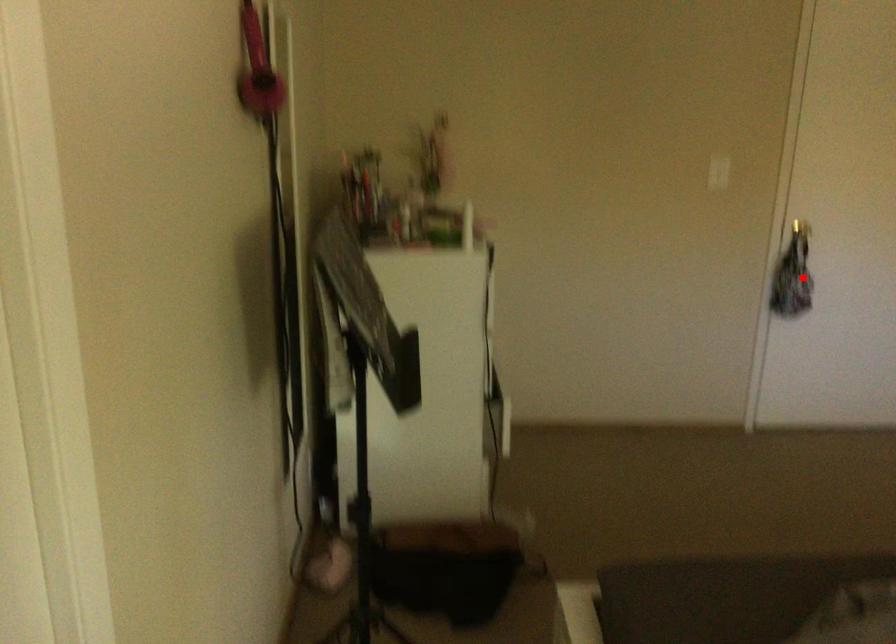
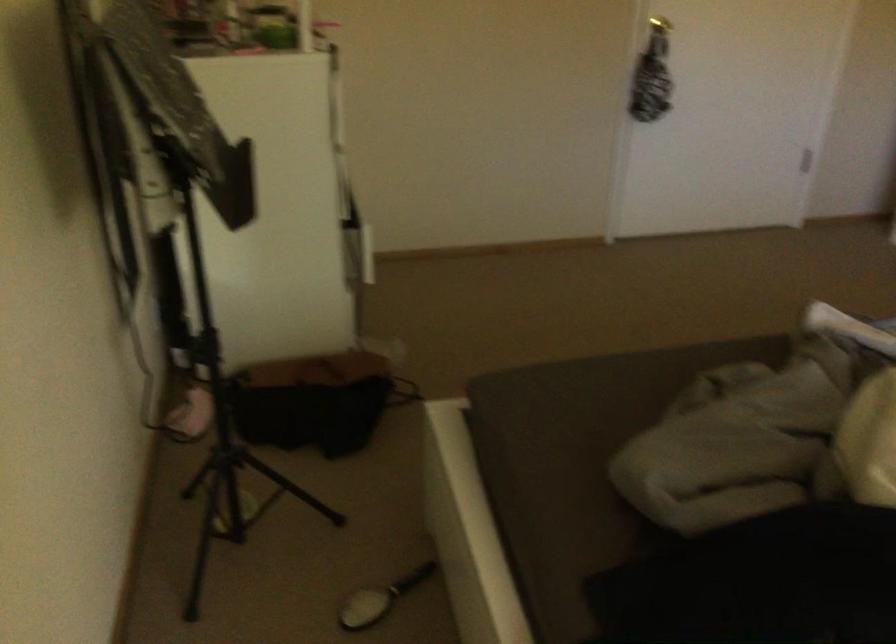
Locate, in the second image, the point that corresponds to the highlighted location in the first image.

(649, 87)